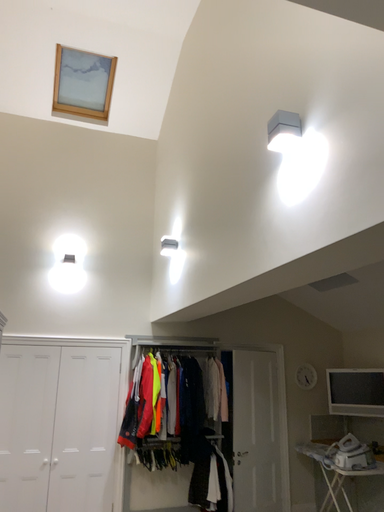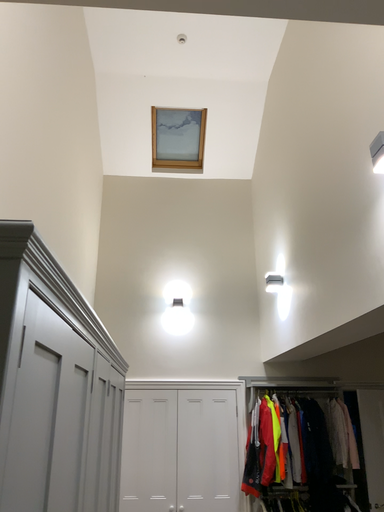
Question: How did the camera likely rotate when shooting the video?

Choices:
 (A) rotated right
 (B) rotated left

Answer: (B)